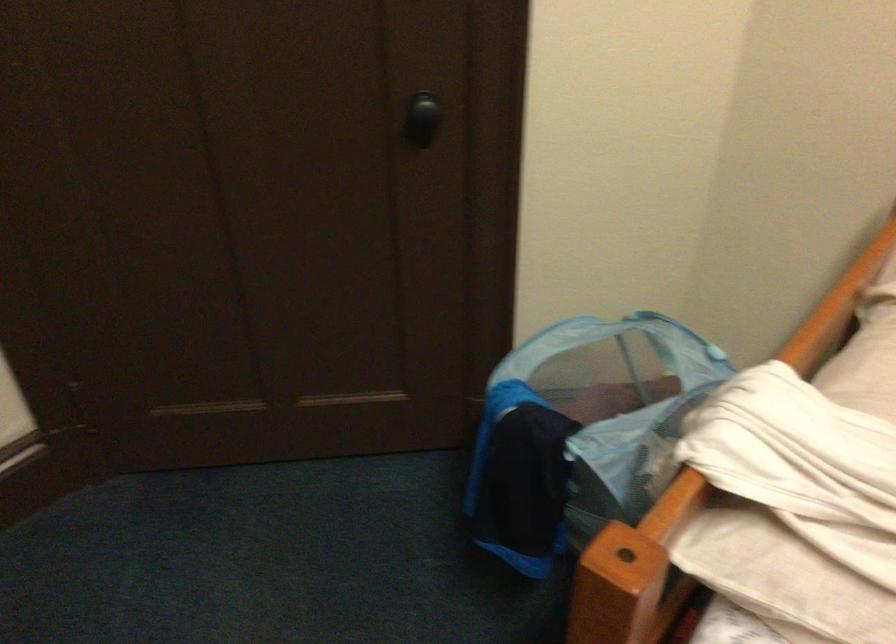
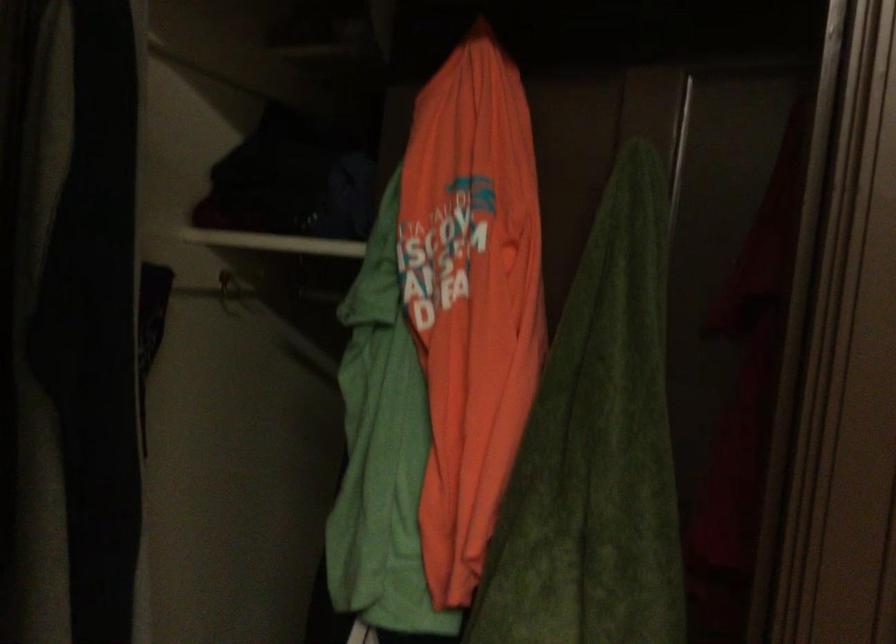
Question: The camera is either moving clockwise (left) or counter-clockwise (right) around the object. The first image is from the beginning of the video and the second image is from the end. Is the camera moving left or right when shooting the video?

Choices:
 (A) Left
 (B) Right

Answer: (B)